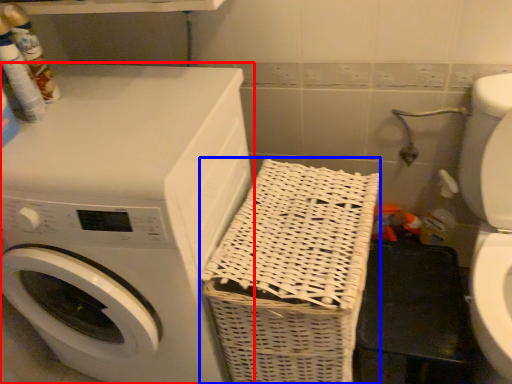
Question: Among these objects, which one is nearest to the camera, washing machine (highlighted by a red box) or basket (highlighted by a blue box)?

Choices:
 (A) washing machine
 (B) basket

Answer: (A)